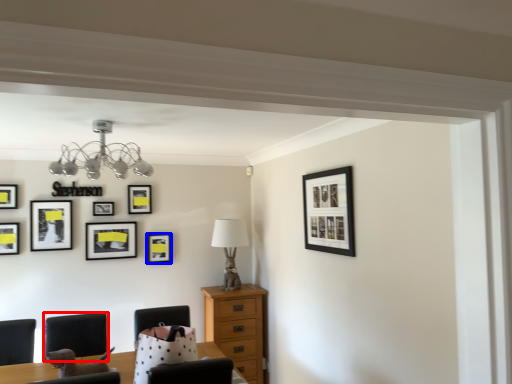
Question: Which point is closer to the camera, armchair (highlighted by a red box) or picture frame (highlighted by a blue box)?

Choices:
 (A) armchair
 (B) picture frame

Answer: (A)